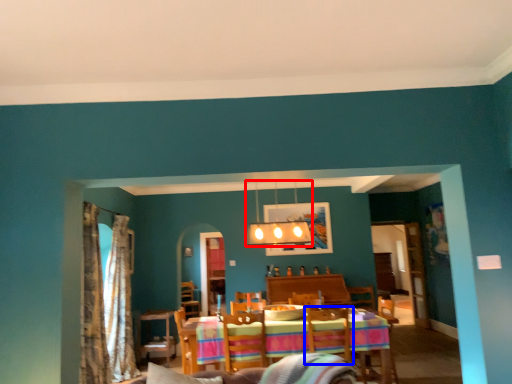
Question: Which object is further to the camera taking this photo, lamp (highlighted by a red box) or swivel chair (highlighted by a blue box)?

Choices:
 (A) lamp
 (B) swivel chair

Answer: (A)